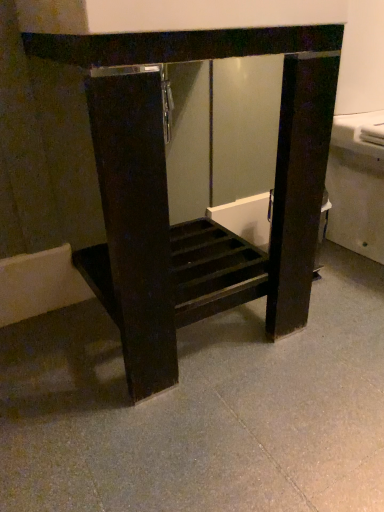
This screenshot has height=512, width=384. In order to click on free space above gray polished concrete at center (from a real-world perspective) in this screenshot , I will do `click(242, 387)`.